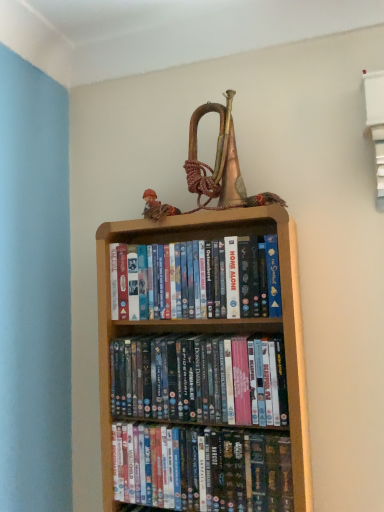
Question: Is point (168, 239) closer or farther from the camera than point (162, 395)?

Choices:
 (A) farther
 (B) closer

Answer: (A)

Question: Is wooden bookcase at center spatially inside matte plastic dvds at center, positioned as the 2th book in bottom-to-top order, or outside of it?

Choices:
 (A) outside
 (B) inside

Answer: (A)

Question: Based on their relative distances, which object is farther from the shiny plastic dvds at center, which is the third book from top to bottom?

Choices:
 (A) wooden bookcase at center
 (B) matte plastic dvds at center, marked as the 2th book in a top-to-bottom arrangement
 (C) matte plastic dvds at center, the first book viewed from the top
 (D) matte brown doll at upper center

Answer: (D)

Question: Estimate the real-world distances between objects in this image. Which object is farther from the matte plastic dvds at center, marked as the 2th book in a top-to-bottom arrangement?

Choices:
 (A) wooden bookcase at center
 (B) shiny plastic dvds at center, arranged as the first book when ordered from the bottom
 (C) matte brown doll at upper center
 (D) matte plastic dvds at center, acting as the 3th book starting from the bottom

Answer: (C)